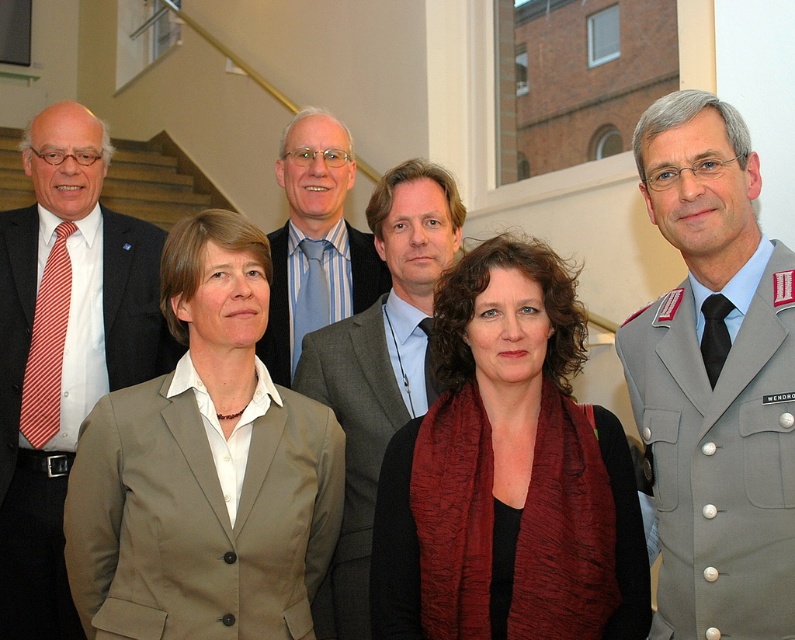
Does beige fabric suit at center have a smaller size compared to light blue striped tie at center?

Actually, beige fabric suit at center might be larger than light blue striped tie at center.

Between point (113, 499) and point (359, 273), which one is positioned in front?

Point (113, 499) is more forward.

You are a GUI agent. You are given a task and a screenshot of the screen. Output one action in this format:
    pyautogui.click(x=<x>, y=<y>)
    Task: Click on the beige fabric suit at center
    The height and width of the screenshot is (640, 795).
    Given the screenshot: What is the action you would take?
    pyautogui.click(x=204, y=467)

Is gray uniform at center thinner than light blue striped tie at center?

Correct, gray uniform at center's width is less than light blue striped tie at center's.

Is point (727, 600) positioned after point (270, 323)?

That is False.

Find the location of a particular element. The width and height of the screenshot is (795, 640). gray uniform at center is located at coordinates 716,380.

Is gray wool suit at center to the left of light blue striped tie at center from the viewer's perspective?

Incorrect, gray wool suit at center is not on the left side of light blue striped tie at center.

Can you confirm if gray wool suit at center is shorter than light blue striped tie at center?

No, gray wool suit at center is not shorter than light blue striped tie at center.

Image resolution: width=795 pixels, height=640 pixels. Describe the element at coordinates (379, 369) in the screenshot. I see `gray wool suit at center` at that location.

Locate an element on the screen. The height and width of the screenshot is (640, 795). gray wool suit at center is located at coordinates (379, 369).